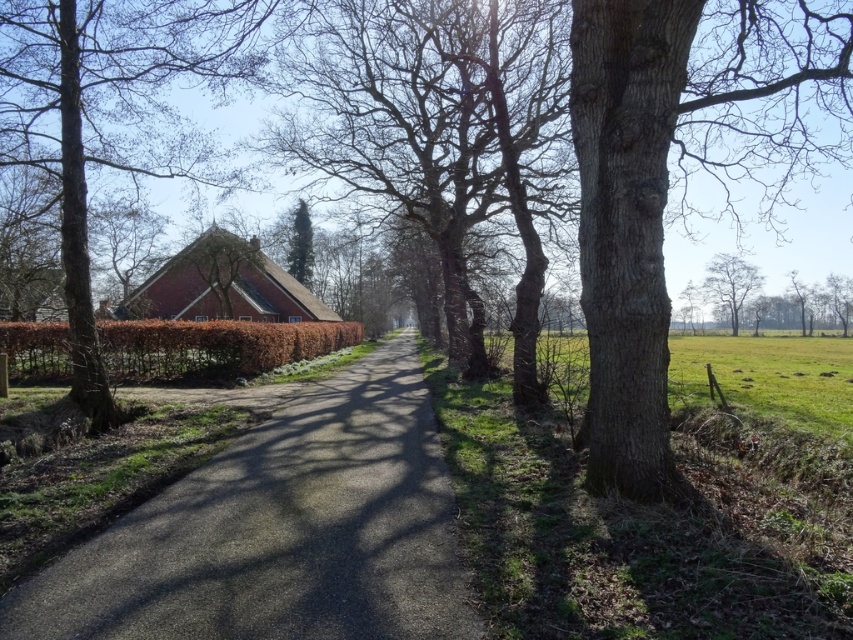
Question: Is gray rough bark tree at right positioned in front of bare bark tree at center?

Choices:
 (A) no
 (B) yes

Answer: (B)

Question: Does bare bark tree at center appear under brown textured hedge at left?

Choices:
 (A) no
 (B) yes

Answer: (A)

Question: Which object is positioned farthest from the brown textured hedge at left?

Choices:
 (A) bare bark tree at center
 (B) green leafy tree at center
 (C) smooth bark tree at upper right

Answer: (C)

Question: From the image, what is the correct spatial relationship of bare bark tree at center in relation to brown rough tree at left?

Choices:
 (A) left
 (B) right

Answer: (B)

Question: Which of the following is the closest to the observer?

Choices:
 (A) (363, 189)
 (B) (740, 280)

Answer: (A)

Question: Which point is farther to the camera?

Choices:
 (A) (251, 49)
 (B) (293, 244)
 (C) (795, 52)
 (D) (131, 525)

Answer: (B)